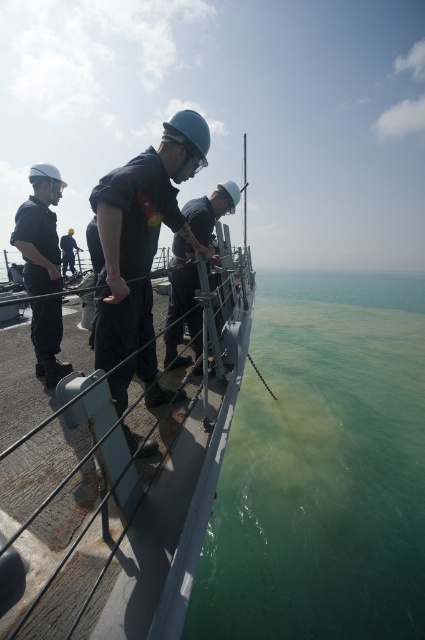
You are a sailor on the deck of the ship. You notice the metallic gray boat at center and the dark blue uniform at center. Which object is narrower in width?

The metallic gray boat at center is thinner than the dark blue uniform at center, so the metallic gray boat at center is narrower in width.

You are a ship navigator who needs to determine the coordinates of the metallic gray boat at center. What are its coordinates?

The coordinates of the metallic gray boat at center are at point (121, 436).